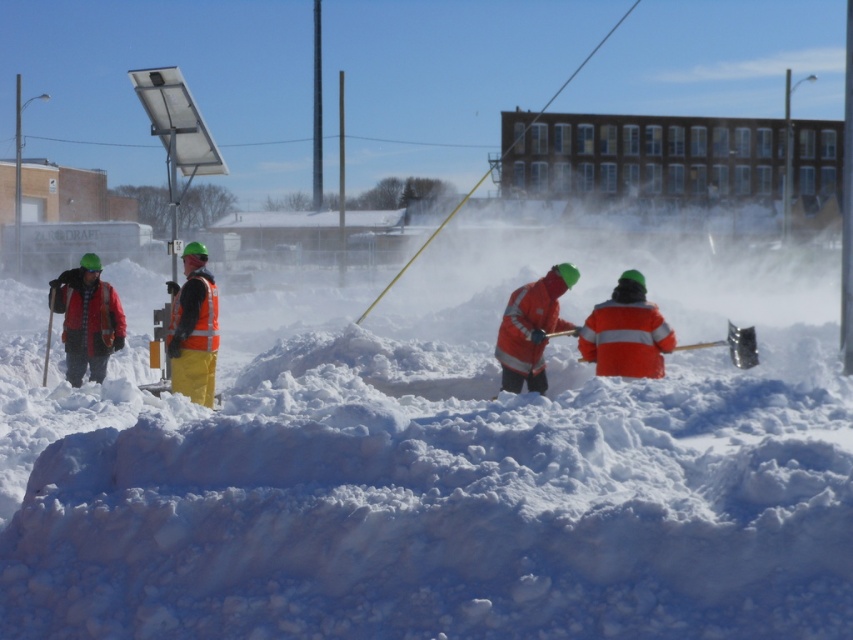
You are a worker in the snow scene. You need to determine which clothing item is shorter in height between the plaid wool jacket at left and the orange reflective vest at center. Which one is shorter?

The plaid wool jacket at left has a lesser height compared to the orange reflective vest at center, so the plaid wool jacket at left is shorter in height.

You are a delivery person trying to navigate through the snow to deliver a package. There is a plaid wool jacket at left and an orange reflective vest at center in your path. Can you pass through the space between them without stepping on the snow? Please explain your reasoning based on the distance provided.

The distance between the plaid wool jacket at left and the orange reflective vest at center is 6.83 feet. Since this distance is sufficient for a person to walk through without needing to step on the snow between them, you can pass through the space safely.

You are a worker in the snow removal team. You need to place a marker on the white fluffy snow at center and the orange reflective shovel at center. According to the scene, which object should you place the marker on first if you want to follow the left to right order?

The white fluffy snow at center should be marked first because it is positioned on the left side of the orange reflective shovel at center, so left to right order would require marking it first.